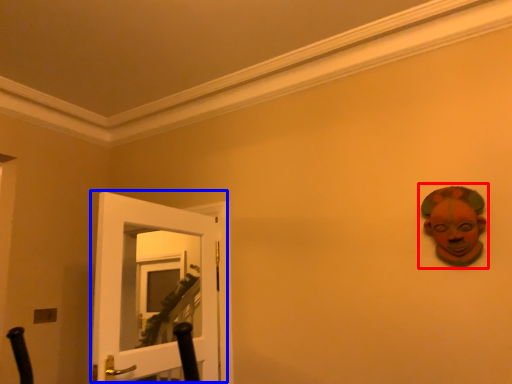
Question: Which of the following is the closest to the observer, person (highlighted by a red box) or door (highlighted by a blue box)?

Choices:
 (A) person
 (B) door

Answer: (B)